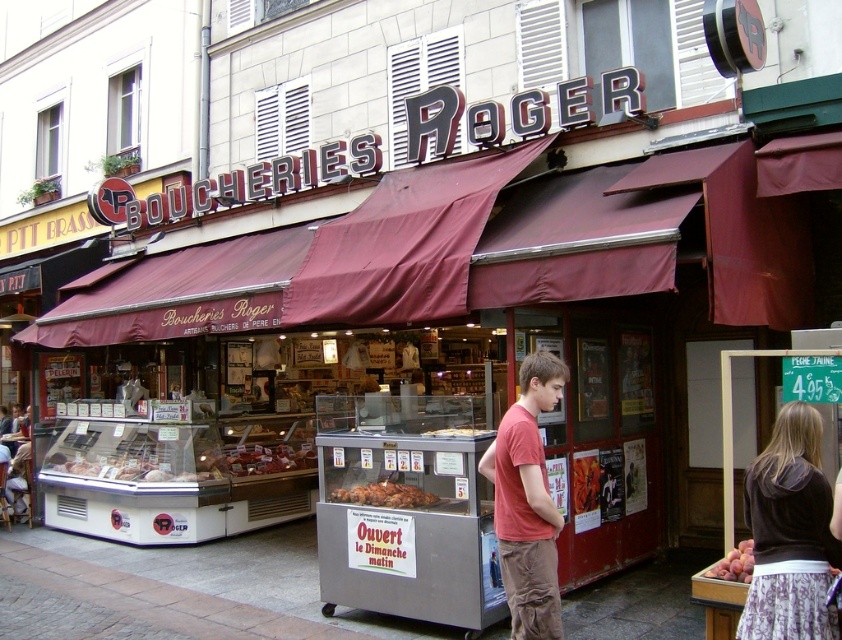
You are a customer at Boucheries Roger and want to buy both the velvet brown hoodie at center right and the golden brown croissant at center. However, your bag can only hold one item. Based on their sizes, which item should you choose to fit in your bag?

The velvet brown hoodie at center right is larger in size than the golden brown croissant at center, so you should choose the golden brown croissant at center to fit in your bag.